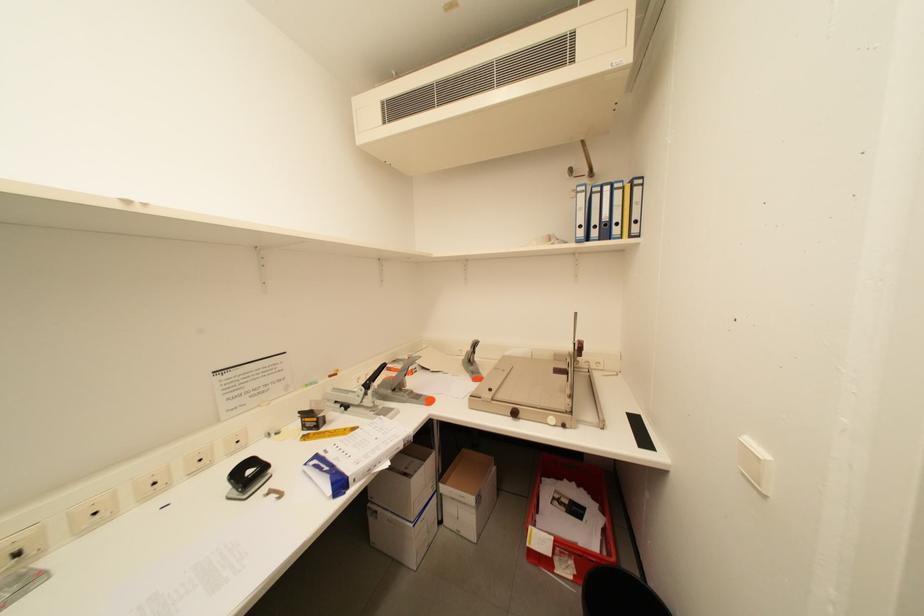
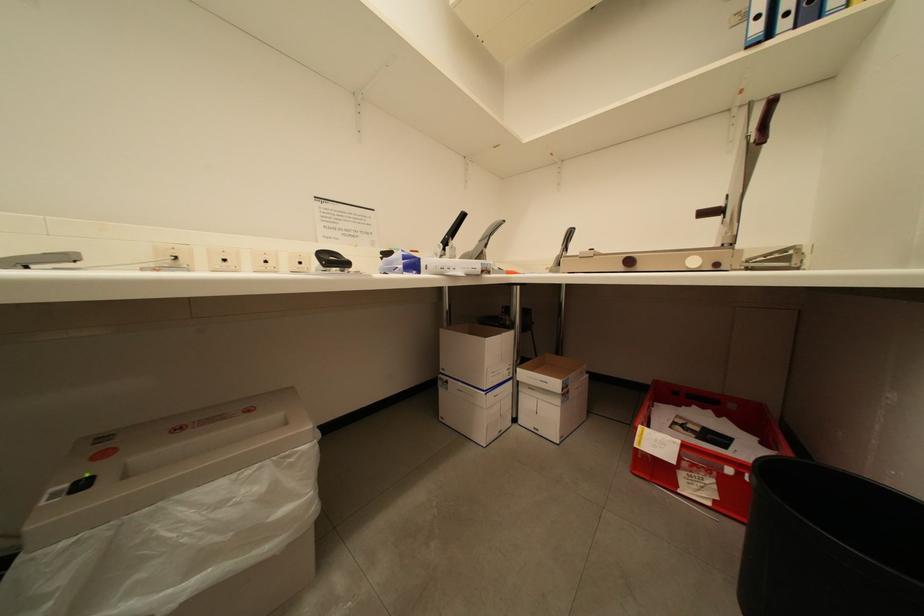
Question: What movement of the cameraman would produce the second image?

Choices:
 (A) Left
 (B) Right
 (C) Forward
 (D) Backward

Answer: (C)